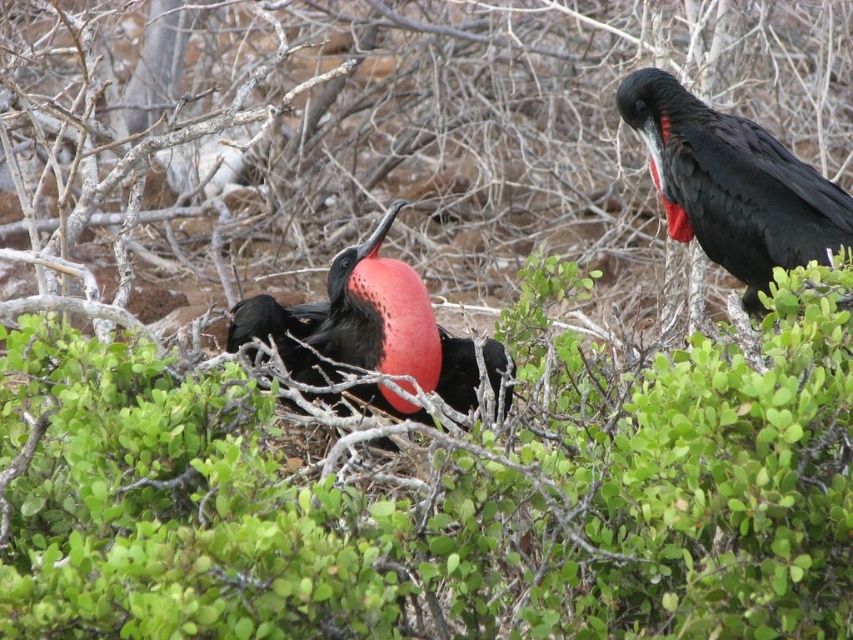
From the picture: How much distance is there between green leafy shrub at center and matte black bird at center?

A distance of 49.96 centimeters exists between green leafy shrub at center and matte black bird at center.

Is point (83, 484) positioned in front of point (258, 300)?

That is True.

Image resolution: width=853 pixels, height=640 pixels. Find the location of `green leafy shrub at center`. green leafy shrub at center is located at coordinates (440, 492).

Can you confirm if green leafy shrub at center is thinner than shiny black bird at upper right?

Incorrect, green leafy shrub at center's width is not less than shiny black bird at upper right's.

Is green leafy shrub at center closer to camera compared to shiny black bird at upper right?

Yes, green leafy shrub at center is closer to the viewer.

Locate an element on the screen. The width and height of the screenshot is (853, 640). green leafy shrub at center is located at coordinates (440, 492).

The width and height of the screenshot is (853, 640). In order to click on green leafy shrub at center in this screenshot , I will do `click(440, 492)`.

From the picture: Who is shorter, shiny black bird at upper right or matte black bird at center?

With less height is matte black bird at center.

In the scene shown: Is shiny black bird at upper right closer to camera compared to matte black bird at center?

No, it is not.

Does point (770, 134) lie behind point (358, 356)?

Yes, it is behind point (358, 356).

Locate an element on the screen. shiny black bird at upper right is located at coordinates (732, 184).